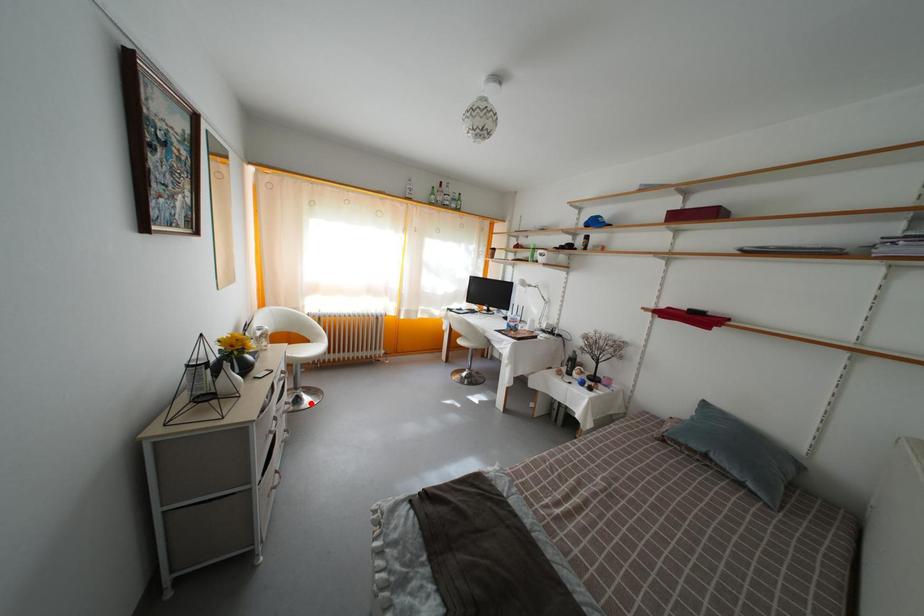
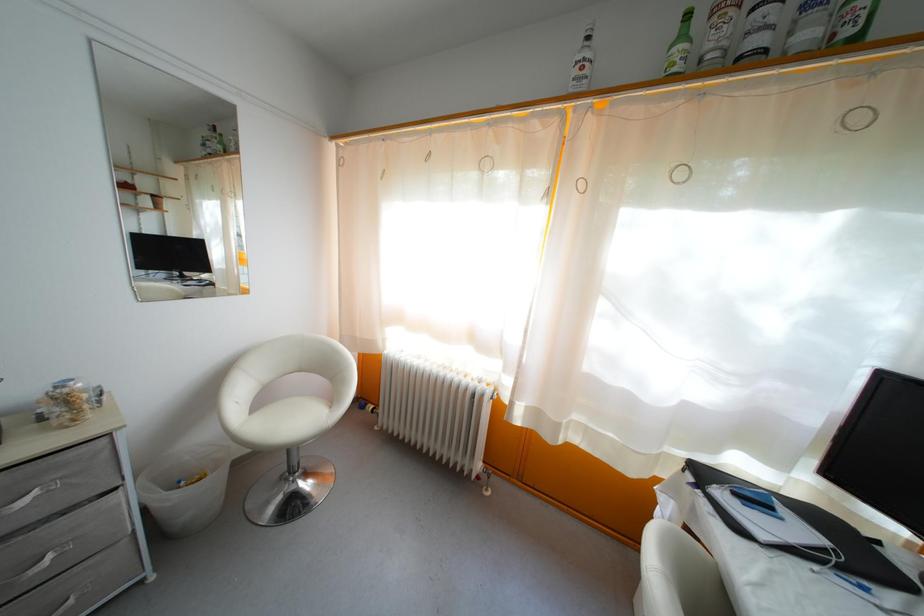
Question: I am providing you with two images of the same scene from different viewpoints. Image1 has a red point marked. In image2, the corresponding 3D location appears at what relative position? Reply with the corresponding letter.

Choices:
 (A) Closer
 (B) Farther

Answer: (B)